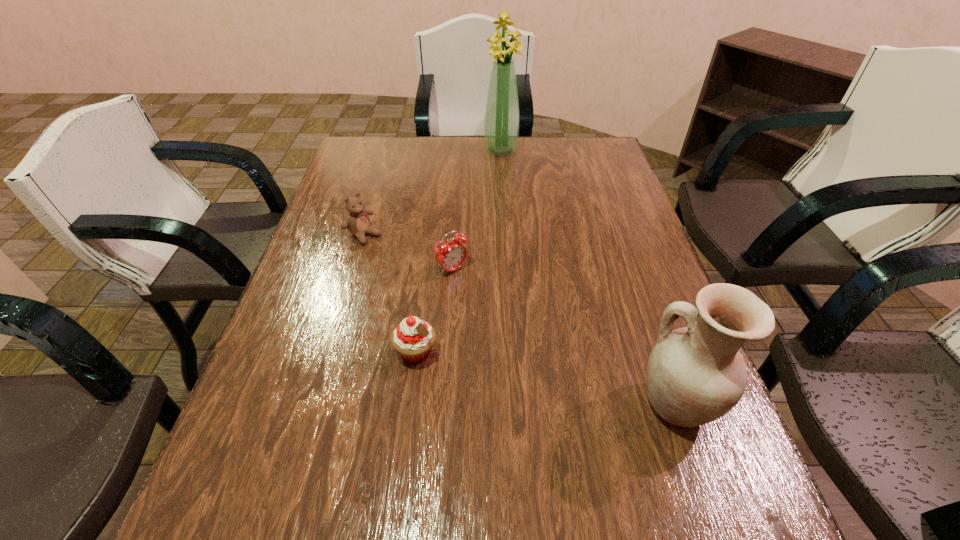
Image resolution: width=960 pixels, height=540 pixels. Find the location of `cupcake`. cupcake is located at coordinates (413, 338).

Where is `the fourth shortest object`? This screenshot has height=540, width=960. the fourth shortest object is located at coordinates (695, 374).

Locate an element on the screen. The image size is (960, 540). pottery is located at coordinates (695, 374).

Identify the location of the tallest object. The width and height of the screenshot is (960, 540). (501, 124).

I want to click on bouquet, so click(501, 124).

Where is `teddy bear`? teddy bear is located at coordinates (358, 222).

Locate an element on the screen. The width and height of the screenshot is (960, 540). the fourth nearest object is located at coordinates (358, 222).

The image size is (960, 540). What are the coordinates of `the third nearest object` in the screenshot? It's located at (450, 255).

The image size is (960, 540). I want to click on free space located 0.050m on the right of the cupcake, so (x=461, y=352).

Find the location of a particular element. Image resolution: width=960 pixels, height=540 pixels. vacant space located 0.070m on the left of the fourth shortest object is located at coordinates click(x=599, y=404).